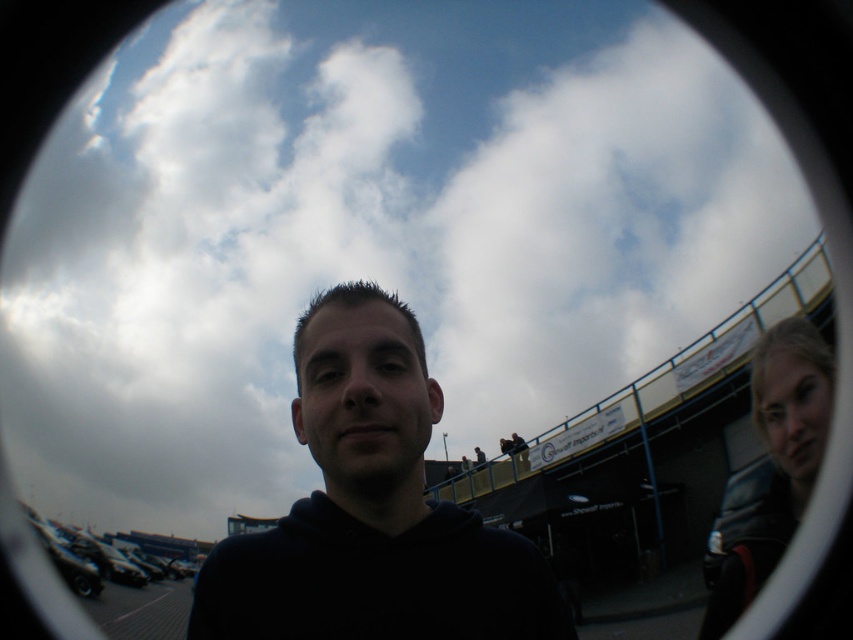
You are analyzing the composition of the image. Where is the black matte hoodie at center located in terms of coordinates?

The black matte hoodie at center is located at coordinates point (x=372, y=509).

You are a photographer trying to capture both the black matte hoodie at center and the dark gray leather jacket at right in a single shot. Based on their positions, which one should you adjust your camera to focus on first to ensure both are in frame?

The black matte hoodie at center is positioned on the left side of dark gray leather jacket at right, so you should focus on the dark gray leather jacket at right first as it is on the right side and ensure the camera captures both from left to right.

You are a photographer trying to capture both the black matte hoodie at center and the dark gray leather jacket at right in the same frame. Based on their positions, which one would appear larger in your photo?

The black matte hoodie at center appears larger in the photo because it is closer to the viewer than the dark gray leather jacket at right.